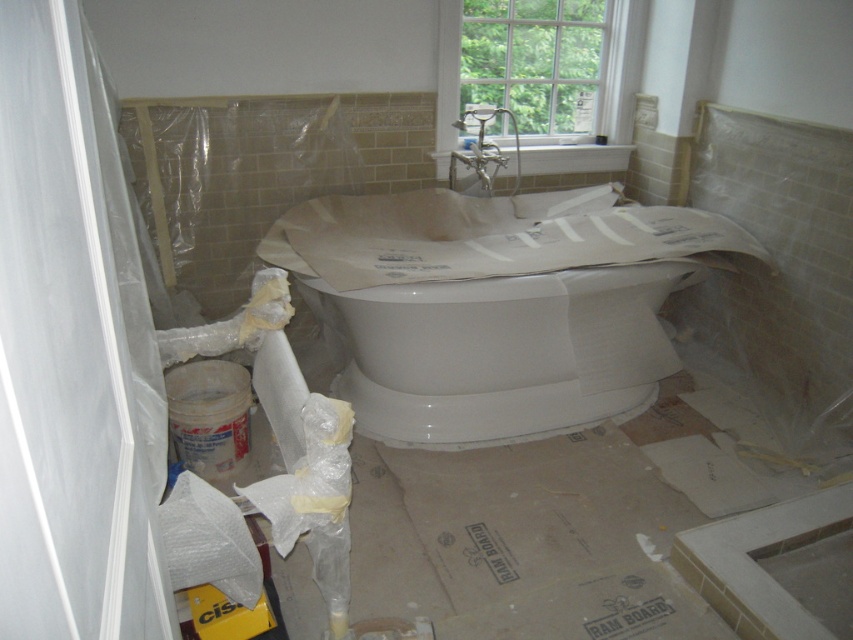
Can you confirm if white glossy bathtub at center is taller than clear glass window at upper center?

Correct, white glossy bathtub at center is much taller as clear glass window at upper center.

Between point (585, 353) and point (602, 120), which one is positioned in front?

Point (585, 353)

Is point (582, 268) in front of point (561, 113)?

Yes.

Locate an element on the screen. The height and width of the screenshot is (640, 853). white glossy bathtub at center is located at coordinates (483, 324).